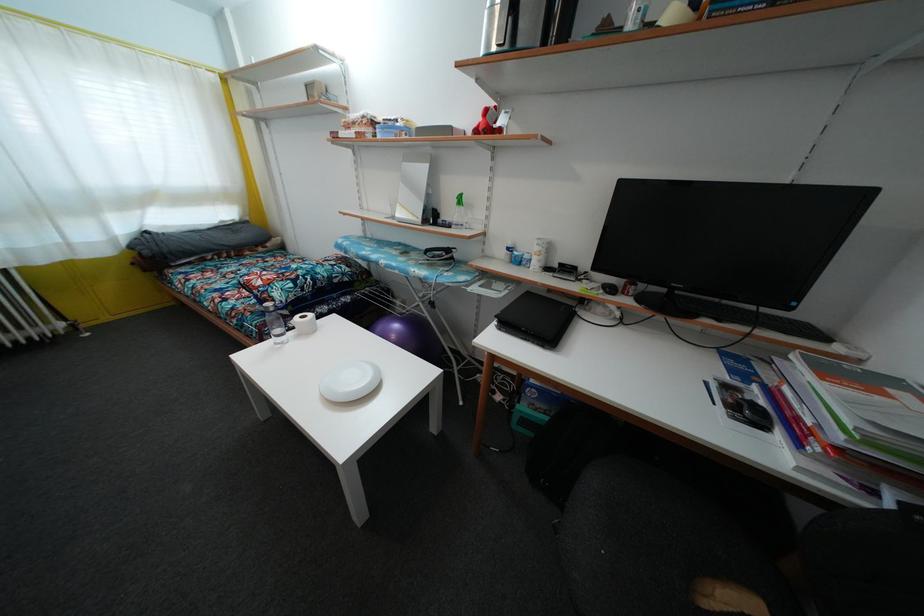
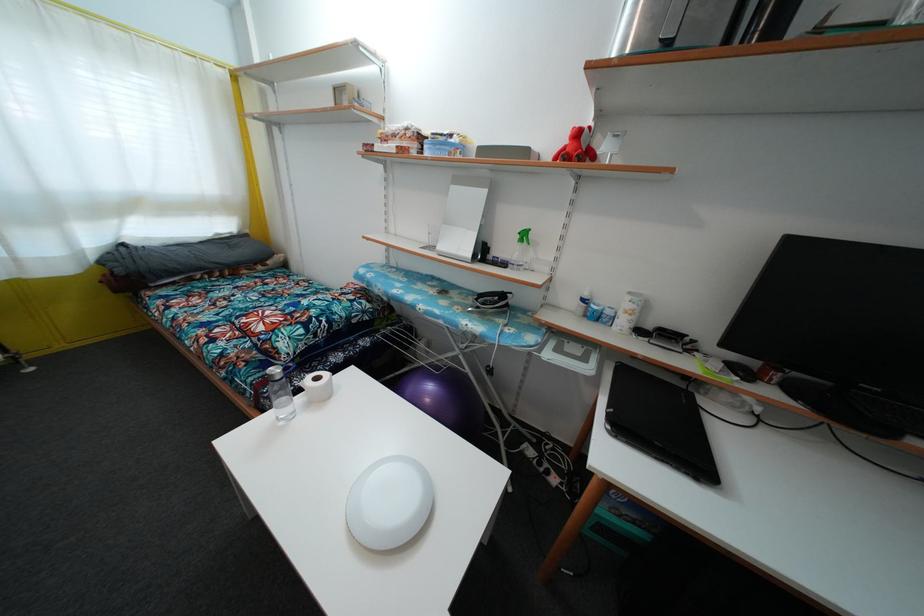
The point at (432, 156) is marked in the first image. Where is the corresponding point in the second image?

(488, 177)